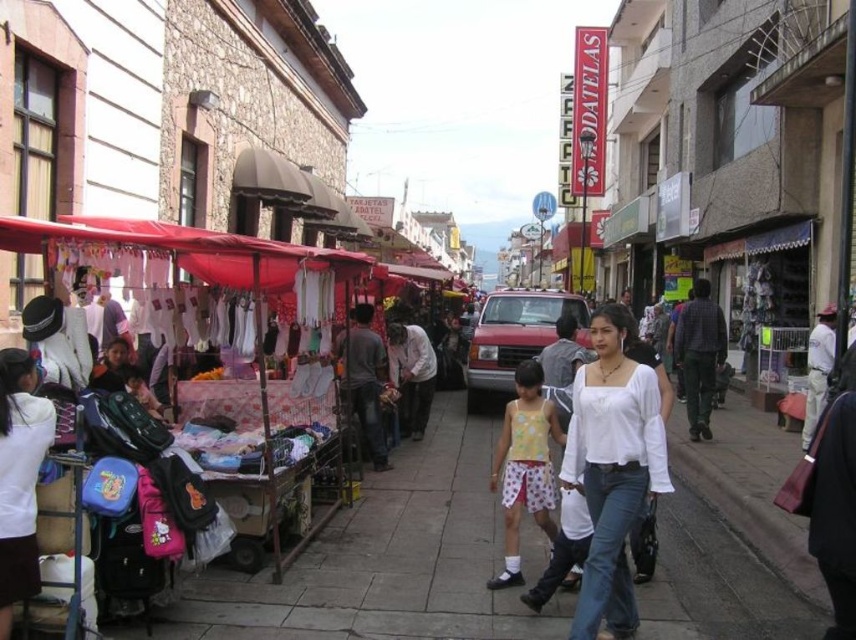
You are a delivery person trying to walk through the market. You see the smooth concrete sidewalk at center and the white cotton blouse at center. Which path is narrower for you to walk on?

The smooth concrete sidewalk at center is narrower than the white cotton blouse at center, so you should choose the white cotton blouse at center for walking.

You are a delivery person who needs to place a heavy box on the smooth concrete sidewalk at center. However, there is a white cotton blouse at center nearby. Which object is lower to the ground so that you can safely place the box without damaging the blouse?

The smooth concrete sidewalk at center has a lesser height compared to the white cotton blouse at center, so you should place the box on the smooth concrete sidewalk at center to avoid damaging the blouse.